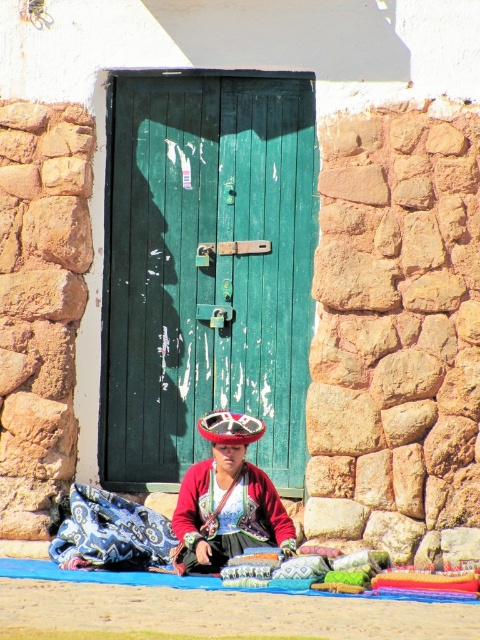
Question: Does embroidered fabric dress at center appear on the right side of shiny metallic hat at center?

Choices:
 (A) no
 (B) yes

Answer: (B)

Question: Which object is the closest to the green wooden door at center?

Choices:
 (A) embroidered fabric dress at center
 (B) shiny metallic hat at center

Answer: (A)

Question: Can you confirm if embroidered fabric dress at center is positioned to the right of shiny metallic hat at center?

Choices:
 (A) yes
 (B) no

Answer: (A)

Question: Which of these objects is positioned closest to the shiny metallic hat at center?

Choices:
 (A) embroidered fabric dress at center
 (B) green wooden door at center

Answer: (A)

Question: Among these points, which one is farthest from the camera?

Choices:
 (A) click(x=255, y=426)
 (B) click(x=250, y=342)

Answer: (B)

Question: Does embroidered fabric dress at center have a greater width compared to shiny metallic hat at center?

Choices:
 (A) no
 (B) yes

Answer: (B)